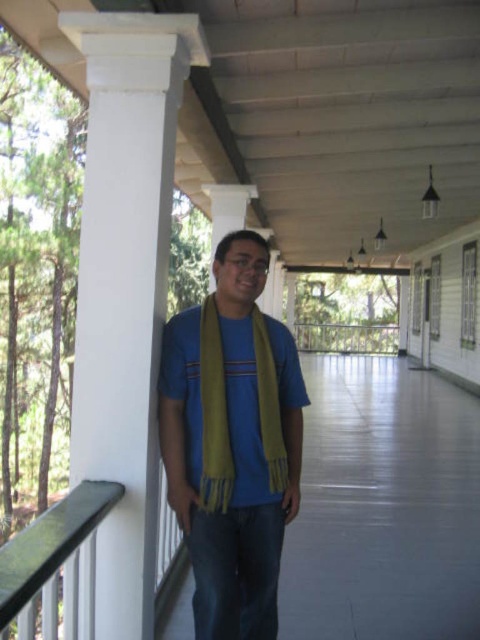
Question: Which point appears farthest from the camera in this image?

Choices:
 (A) (137, 362)
 (B) (218, 410)

Answer: (A)

Question: Does white smooth column at left have a smaller size compared to yellow scarf at center?

Choices:
 (A) no
 (B) yes

Answer: (B)

Question: Considering the relative positions of white smooth column at left and matte yellow scarf at center in the image provided, where is white smooth column at left located with respect to matte yellow scarf at center?

Choices:
 (A) right
 (B) left

Answer: (B)

Question: Which object is closer to the camera taking this photo?

Choices:
 (A) matte yellow scarf at center
 (B) green soft scarf at center
 (C) white smooth column at left

Answer: (A)

Question: Which object appears farthest from the camera in this image?

Choices:
 (A) yellow scarf at center
 (B) white smooth column at left
 (C) green soft scarf at center
 (D) matte yellow scarf at center

Answer: (A)

Question: Can you confirm if yellow scarf at center is positioned above black plastic balustrade at lower left?

Choices:
 (A) yes
 (B) no

Answer: (B)